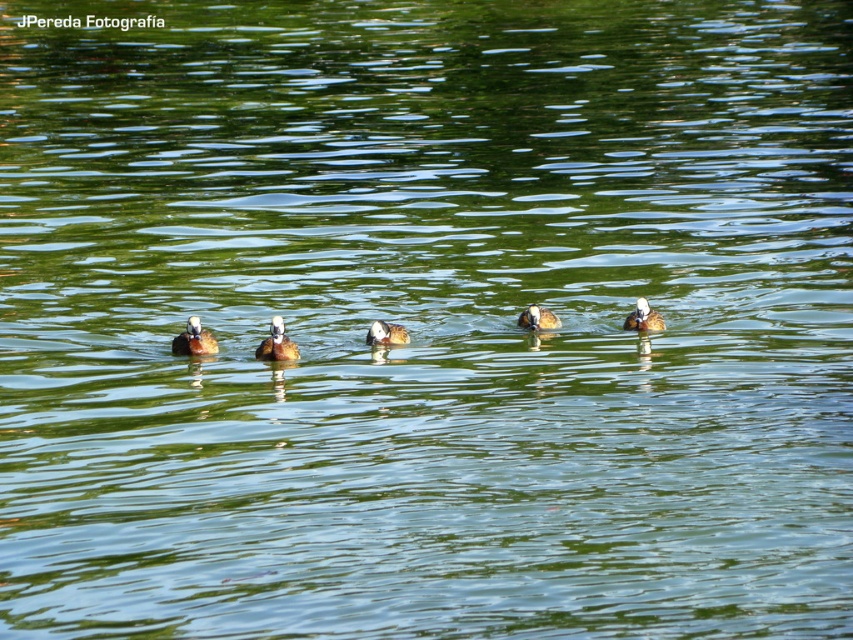
You are a photographer trying to capture a photo of the brown fuzzy duckling at center and the brown matte duck at center. You want to ensure both are in the frame. Since they are in a line, which duck should you focus on first if you start from the left side of the image?

The brown fuzzy duckling at center is positioned on the left side of the brown matte duck at center, so you should focus on the brown fuzzy duckling at center first when starting from the left side.

You are a photographer trying to capture a closeup shot of the brown fuzzy duckling at center and the brown fuzzy duck at center. Which one will appear larger in your photo?

The brown fuzzy duckling at center will appear larger in the photo because it is closer to the viewer than the brown fuzzy duck at center.

You are a photographer trying to capture the ducks in the water. You notice the white fluffy duck at right and the brown fuzzy duck at center. Which duck has a narrower body width?

The white fluffy duck at right has a narrower body width than the brown fuzzy duck at center.